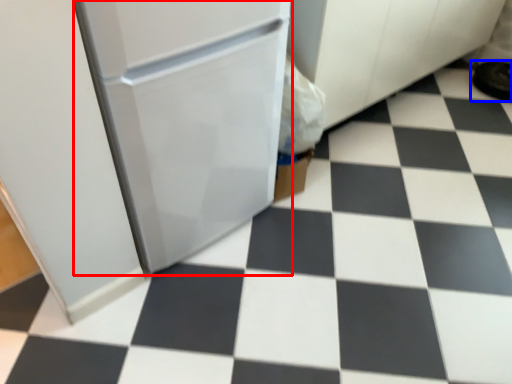
Question: Which object is closer to the camera taking this photo, appliance (highlighted by a red box) or footwear (highlighted by a blue box)?

Choices:
 (A) appliance
 (B) footwear

Answer: (A)